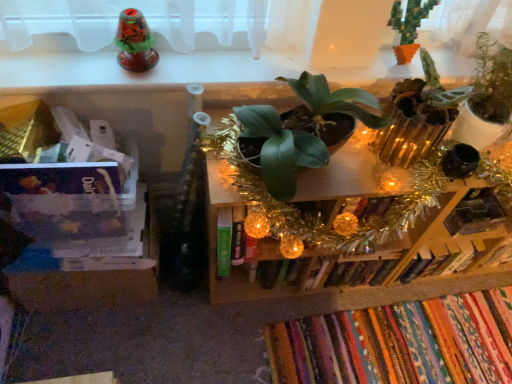
Question: Would you say hardcover book at center-right, which ranks as the 2th book in bottom-to-top order, is part of green leafy plant at center, arranged as the second shelf when viewed from the left,'s contents?

Choices:
 (A) no
 (B) yes

Answer: (A)

Question: Is green leafy plant at center, arranged as the second shelf when viewed from the left, closer to camera compared to hardcover book at center-right, which ranks as the 2th book in bottom-to-top order?

Choices:
 (A) no
 (B) yes

Answer: (B)

Question: Does green leafy plant at center, the 1th shelf from the right, have a smaller size compared to hardcover book at center-right, the 1th book viewed from the top?

Choices:
 (A) yes
 (B) no

Answer: (B)

Question: Would you say green leafy plant at center, the 1th shelf from the right, is a long distance from hardcover book at center-right, which ranks as the 2th book in bottom-to-top order?

Choices:
 (A) yes
 (B) no

Answer: (B)

Question: Is green leafy plant at center, the 1th shelf from the right, oriented away from hardcover book at center-right, which ranks as the 2th book in bottom-to-top order?

Choices:
 (A) yes
 (B) no

Answer: (B)

Question: Is green leafy plant at center, arranged as the second shelf when viewed from the left, bigger than hardcover book at center-right, which ranks as the 2th book in bottom-to-top order?

Choices:
 (A) yes
 (B) no

Answer: (A)

Question: Does green matte plant at center, which ranks as the first houseplant in left-to-right order, have a larger size compared to green matte plant at upper right, the 3th houseplant viewed from the left?

Choices:
 (A) no
 (B) yes

Answer: (B)

Question: Is green matte plant at center, the 3th houseplant from the right, not inside green matte plant at upper right, placed as the 1th houseplant when sorted from right to left?

Choices:
 (A) yes
 (B) no

Answer: (A)

Question: From a real-world perspective, is green matte plant at center, which ranks as the first houseplant in left-to-right order, located higher than green matte plant at upper right, placed as the 1th houseplant when sorted from right to left?

Choices:
 (A) yes
 (B) no

Answer: (B)

Question: Can you confirm if green matte plant at center, the 3th houseplant from the right, is positioned to the left of green matte plant at upper right, placed as the 1th houseplant when sorted from right to left?

Choices:
 (A) yes
 (B) no

Answer: (A)

Question: Is green matte plant at center, the 3th houseplant from the right, taller than green matte plant at upper right, the 3th houseplant viewed from the left?

Choices:
 (A) no
 (B) yes

Answer: (A)

Question: From a real-world perspective, is green matte plant at center, which ranks as the first houseplant in left-to-right order, beneath green matte plant at upper right, the 3th houseplant viewed from the left?

Choices:
 (A) yes
 (B) no

Answer: (A)

Question: Is green matte plant at center, which ranks as the first houseplant in left-to-right order, located within clear plastic container at left, which appears as the second shelf when viewed from the right?

Choices:
 (A) yes
 (B) no

Answer: (B)